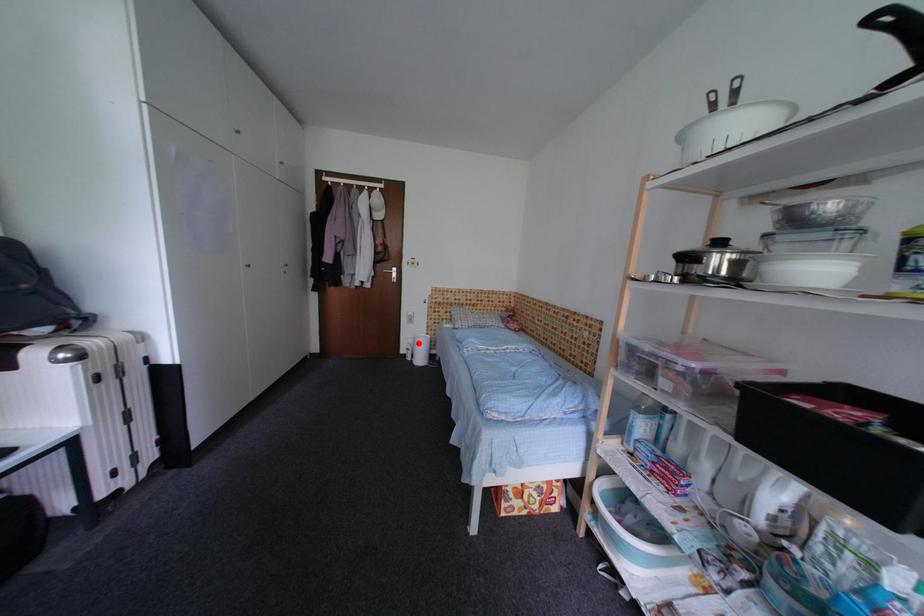
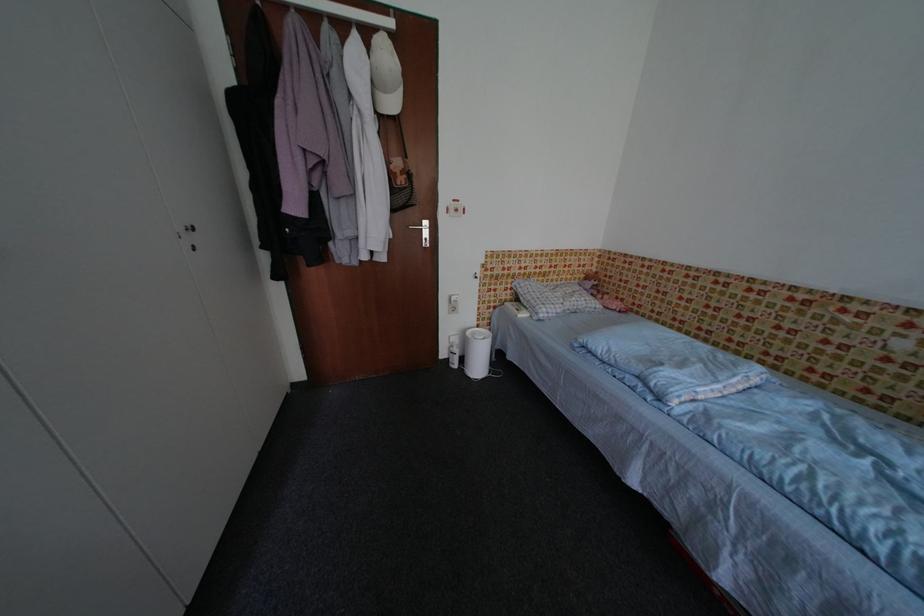
Where in the second image is the point corresponding to the highlighted location from the first image?

(464, 342)